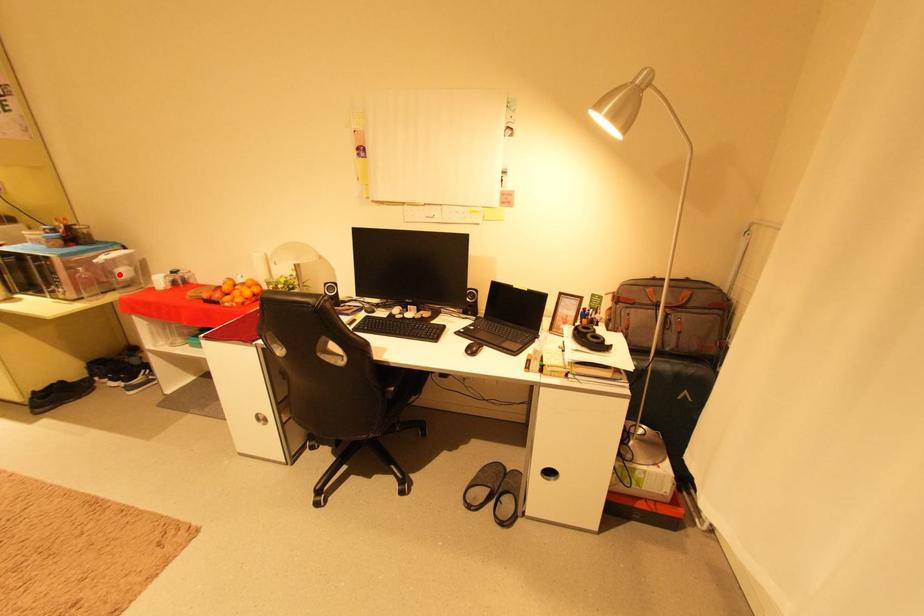
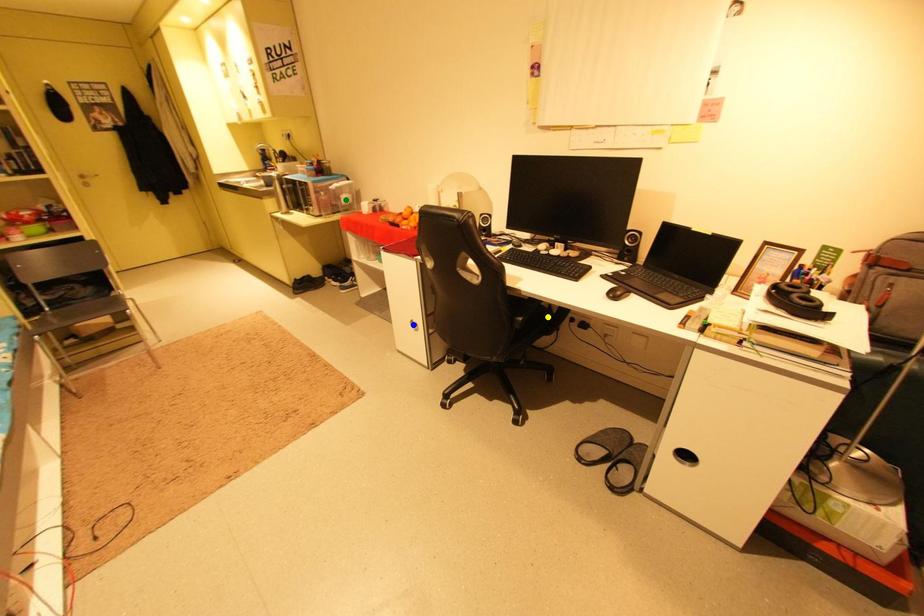
Question: I am providing you with two images of the same scene from different viewpoints. A red point is marked on the first image. You are given multiple points on the second image. Can you choose the point in image 2 that corresponds to the point in image 1?

Choices:
 (A) green point
 (B) yellow point
 (C) blue point

Answer: (A)